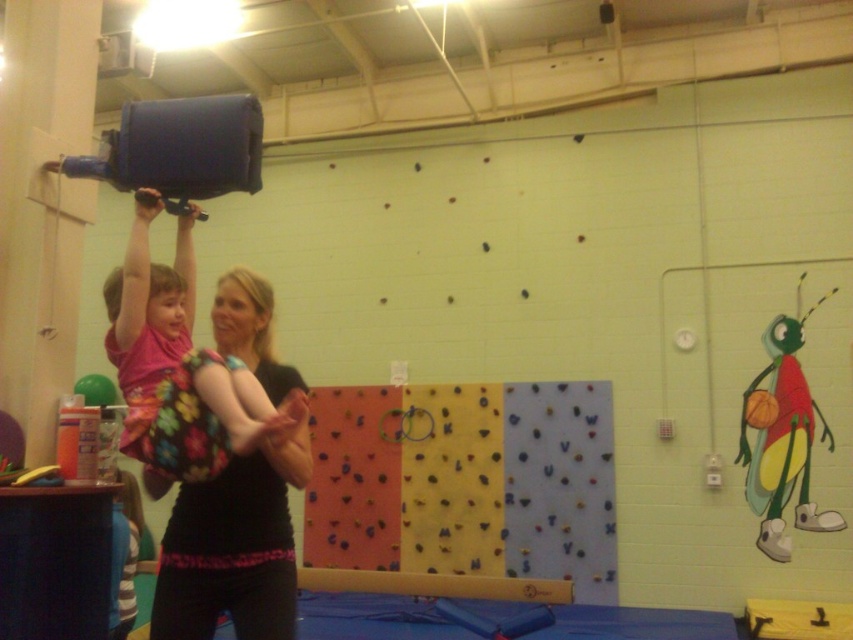
Based on the photo, is black fabric shirt at center above cartoonish fabric bug at right?

Correct, black fabric shirt at center is located above cartoonish fabric bug at right.

Which is above, black fabric shirt at center or cartoonish fabric bug at right?

black fabric shirt at center is above.

Where is `black fabric shirt at center`? This screenshot has height=640, width=853. black fabric shirt at center is located at coordinates point(238,499).

Based on the photo, is yellow foam beam at center positioned behind smooth blonde hair at center?

Yes.

Is yellow foam beam at center to the right of smooth blonde hair at center from the viewer's perspective?

Indeed, yellow foam beam at center is positioned on the right side of smooth blonde hair at center.

You are a GUI agent. You are given a task and a screenshot of the screen. Output one action in this format:
    pyautogui.click(x=<x>, y=<y>)
    Task: Click on the yellow foam beam at center
    The height and width of the screenshot is (640, 853).
    Given the screenshot: What is the action you would take?
    pyautogui.click(x=434, y=584)

Where is `black fabric shirt at center`? black fabric shirt at center is located at coordinates pos(238,499).